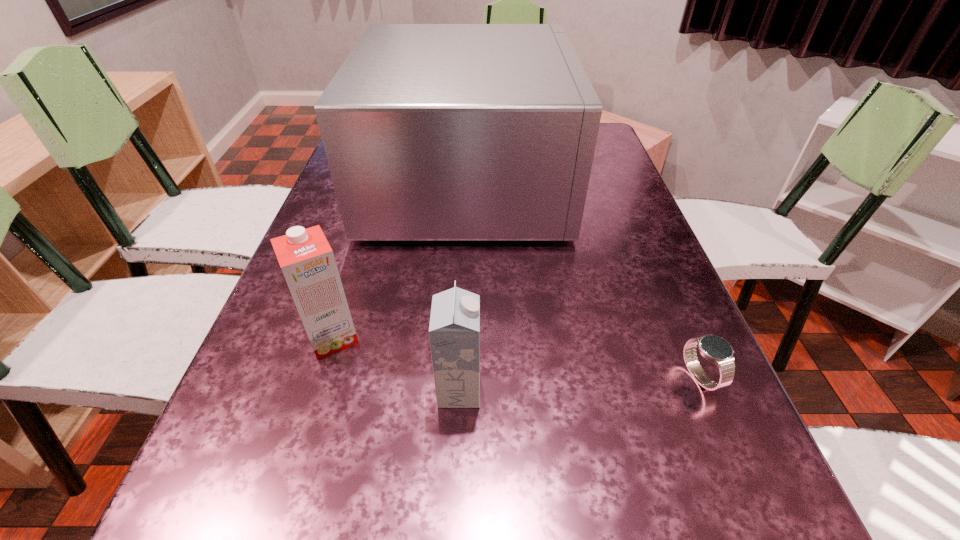
This screenshot has width=960, height=540. Find the location of `free space between the farthest object and the nearer carton`. free space between the farthest object and the nearer carton is located at coordinates (464, 286).

You are a GUI agent. You are given a task and a screenshot of the screen. Output one action in this format:
    pyautogui.click(x=<x>, y=<y>)
    Task: Click on the vacant point located between the nearer carton and the tallest object
    The height and width of the screenshot is (540, 960).
    Given the screenshot: What is the action you would take?
    pyautogui.click(x=464, y=286)

Locate an element on the screen. vacant space that's between the shortest object and the nearer carton is located at coordinates (580, 383).

Locate an element on the screen. This screenshot has width=960, height=540. free space that is in between the left carton and the farthest object is located at coordinates (400, 259).

At what (x,y) coordinates should I click in order to perform the action: click on free space between the microwave oven and the right carton. Please return your answer as a coordinate pair (x, y). The image size is (960, 540). Looking at the image, I should click on (464, 286).

Find the location of a particular element. vacant region between the tallest object and the right carton is located at coordinates (464, 286).

The width and height of the screenshot is (960, 540). Identify the location of vacant space that is in between the left carton and the watch. (516, 356).

I want to click on object that stands as the second closest to the left carton, so click(433, 132).

Locate an element on the screen. The image size is (960, 540). object that ranks as the second closest to the farthest object is located at coordinates (713, 348).

Locate an element on the screen. This screenshot has width=960, height=540. free space that satisfies the following two spatial constraints: 1. on the front side of the watch; 2. on the front label of the nearer carton is located at coordinates (707, 390).